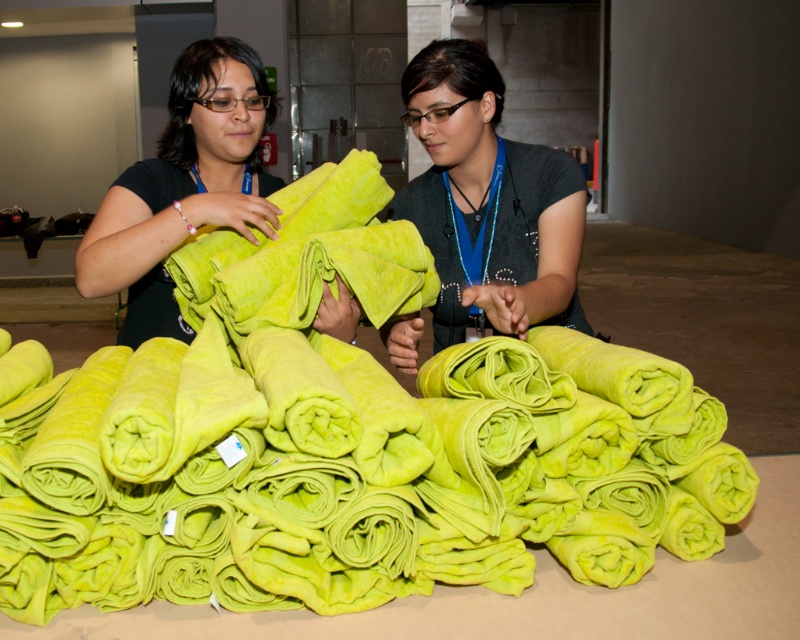
Between lime green fleece blanket at center and matte green towel at center, which one is positioned lower?

lime green fleece blanket at center

Does lime green fleece blanket at center appear on the left side of matte green towel at center?

Correct, you'll find lime green fleece blanket at center to the left of matte green towel at center.

Identify the location of lime green fleece blanket at center. This screenshot has height=640, width=800. (345, 456).

Find the location of `lime green fleece blanket at center`. lime green fleece blanket at center is located at coordinates (345, 456).